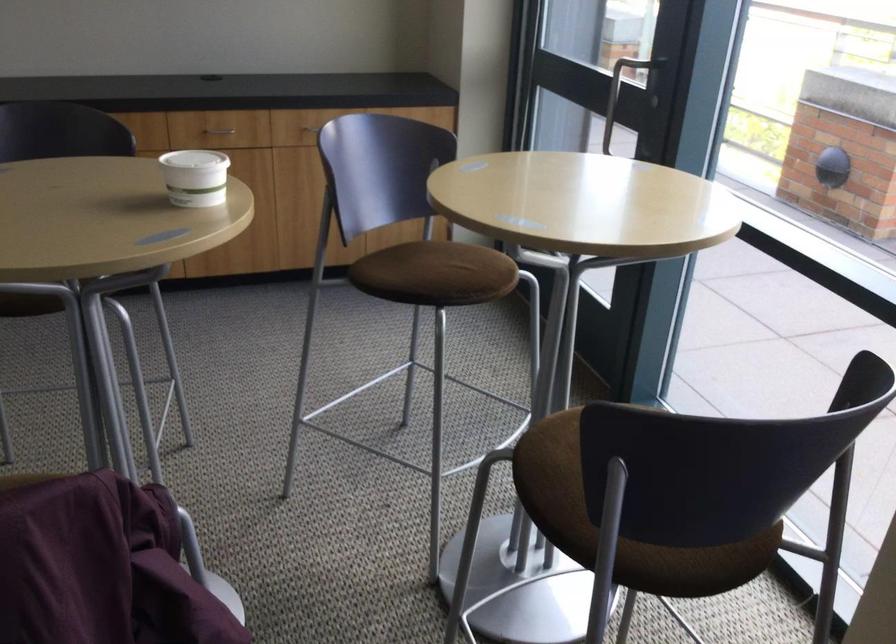
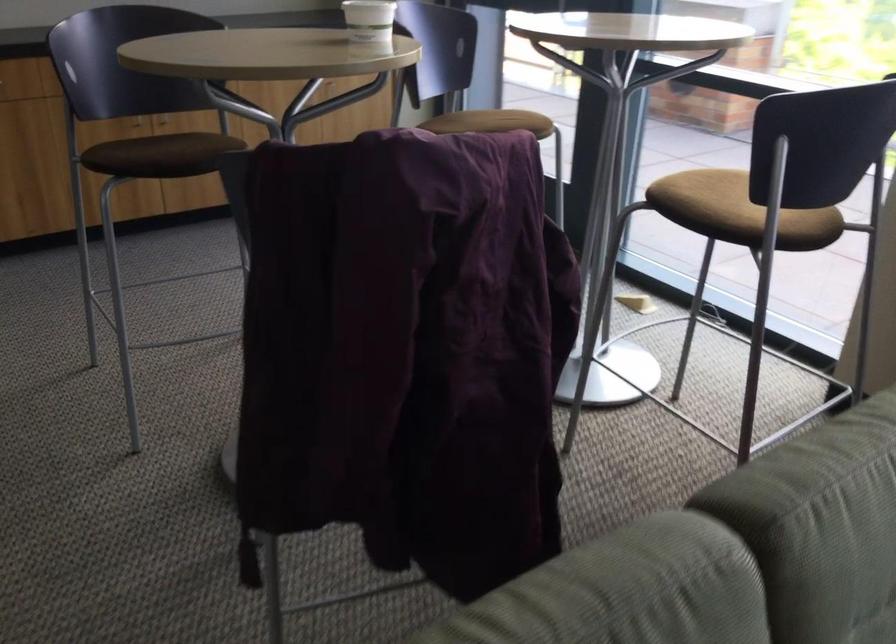
What movement of the cameraman would produce the second image?

The cameraman moved toward left, backward.